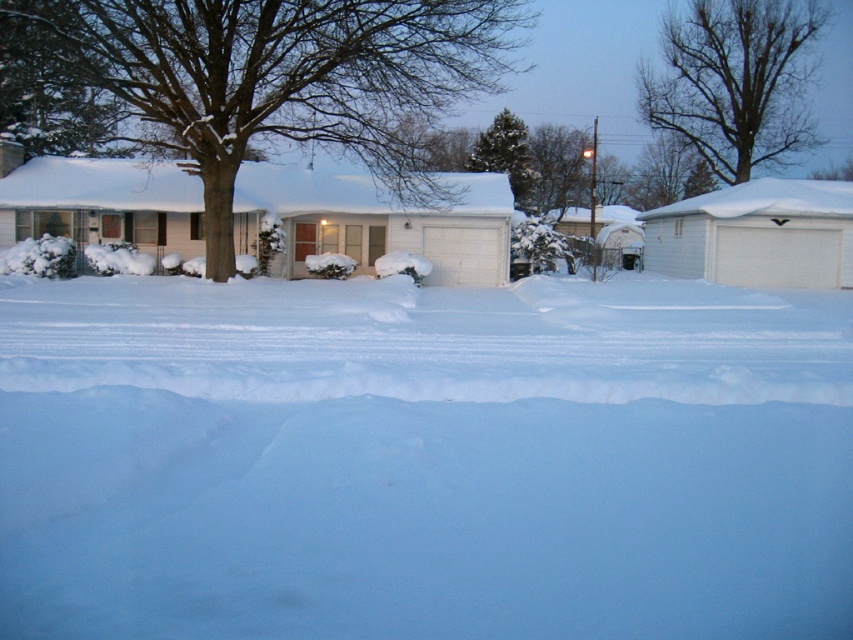
Question: Among these objects, which one is farthest from the camera?

Choices:
 (A) green textured pine tree at upper center
 (B) brown textured tree at center

Answer: (A)

Question: Which point is closer to the camera?

Choices:
 (A) bare branches at upper center
 (B) white fluffy snow at center
 (C) brown textured tree at center

Answer: (B)

Question: Is bare branches at upper center below green textured pine tree at upper center?

Choices:
 (A) yes
 (B) no

Answer: (B)

Question: Is bare branches at upper center smaller than green textured pine tree at upper center?

Choices:
 (A) yes
 (B) no

Answer: (B)

Question: Which point is farther from the camera taking this photo?

Choices:
 (A) (796, 60)
 (B) (628, 499)

Answer: (A)

Question: Is white fluffy snow at center smaller than bare branches at upper center?

Choices:
 (A) no
 (B) yes

Answer: (B)